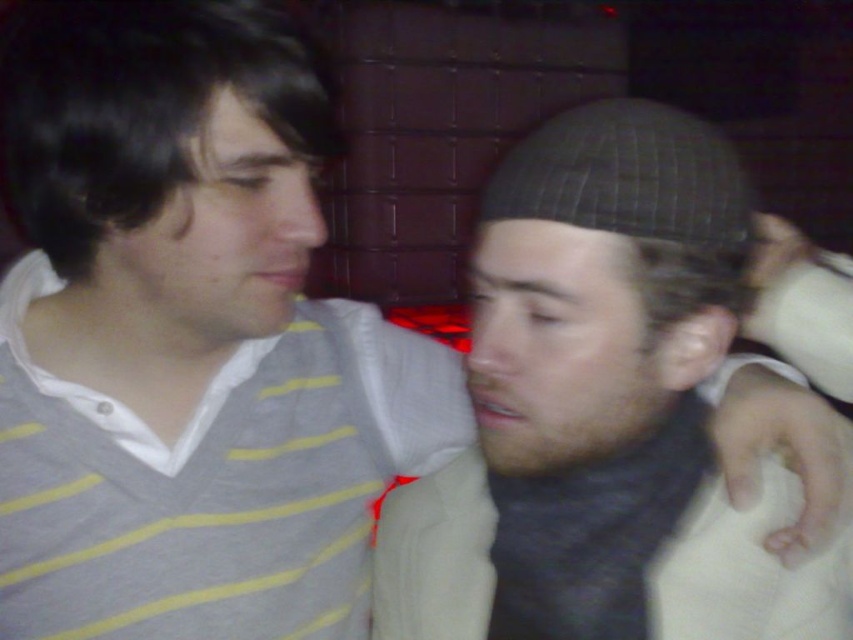
How far apart are dark gray knit cap at center and black textured hat at center?

A distance of 7.04 inches exists between dark gray knit cap at center and black textured hat at center.

Does dark gray knit cap at center have a greater height compared to black textured hat at center?

Indeed, dark gray knit cap at center has a greater height compared to black textured hat at center.

Who is more forward, (x=693, y=349) or (x=624, y=148)?

Point (x=624, y=148) is more forward.

Locate an element on the screen. Image resolution: width=853 pixels, height=640 pixels. dark gray knit cap at center is located at coordinates click(602, 412).